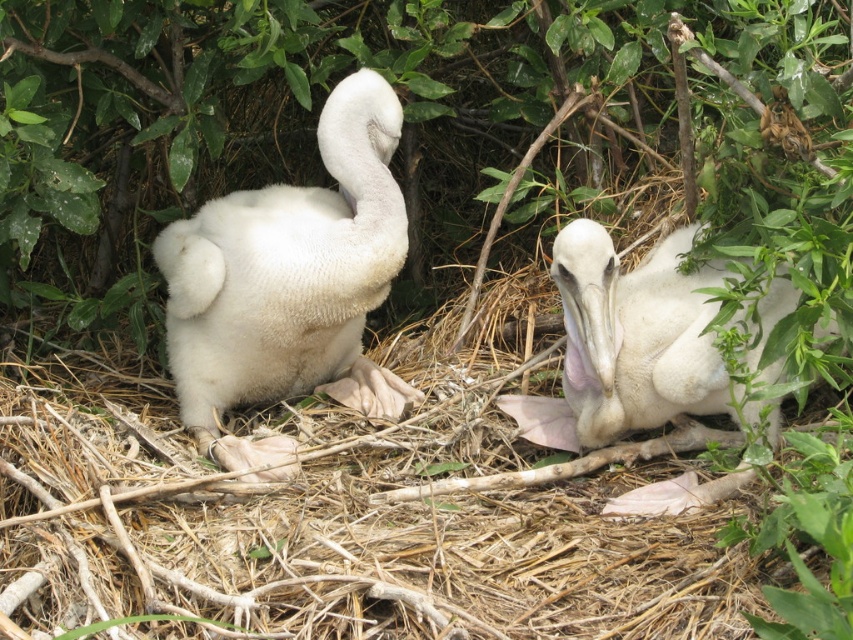
Question: Among these points, which one is farthest from the camera?

Choices:
 (A) (325, 381)
 (B) (573, 262)

Answer: (A)

Question: Can you confirm if white fluffy bird at left is wider than white fluffy bird at center?

Choices:
 (A) no
 (B) yes

Answer: (B)

Question: Which of the following is the closest to the observer?

Choices:
 (A) white fluffy bird at center
 (B) white fluffy bird at left

Answer: (A)

Question: Is white fluffy bird at left to the left of white fluffy bird at center from the viewer's perspective?

Choices:
 (A) no
 (B) yes

Answer: (B)

Question: Which of the following is the farthest from the observer?

Choices:
 (A) white fluffy bird at center
 (B) white fluffy bird at left

Answer: (B)

Question: Does white fluffy bird at left come in front of white fluffy bird at center?

Choices:
 (A) no
 (B) yes

Answer: (A)